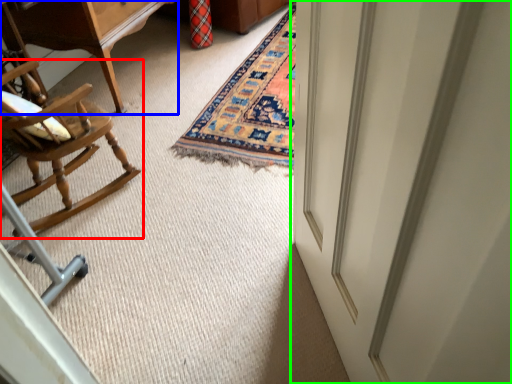
Question: Estimate the real-world distances between objects in this image. Which object is farther from chair (highlighted by a red box), table (highlighted by a blue box) or door (highlighted by a green box)?

Choices:
 (A) table
 (B) door

Answer: (B)